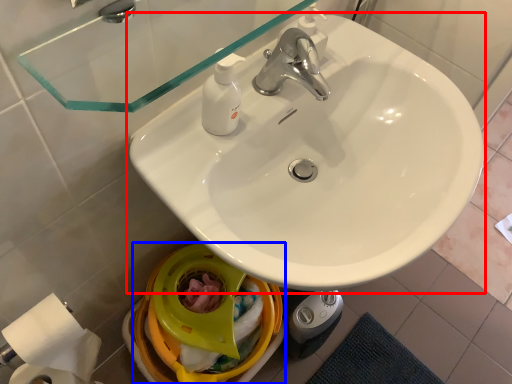
Question: Among these objects, which one is farthest to the camera, sink (highlighted by a red box) or bidet (highlighted by a blue box)?

Choices:
 (A) sink
 (B) bidet

Answer: (B)